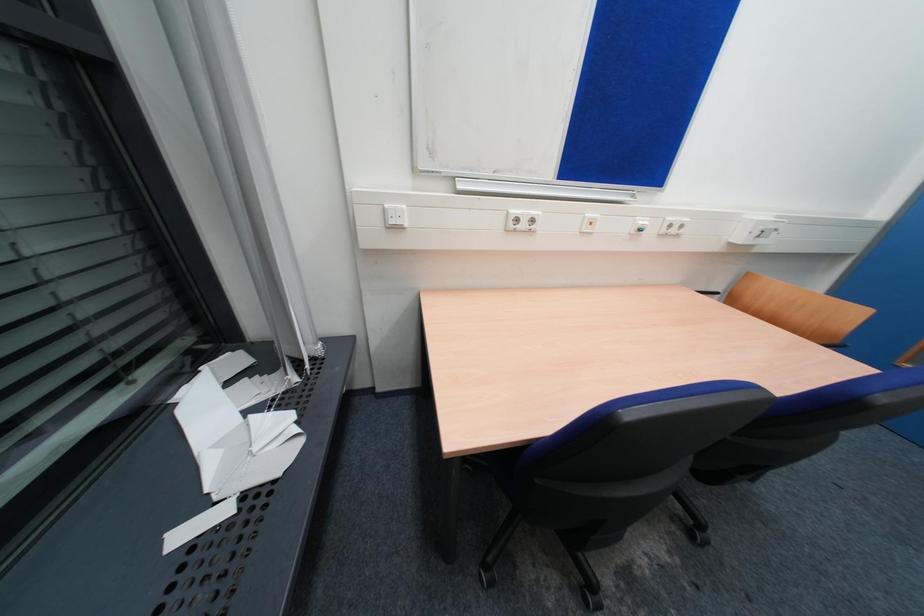
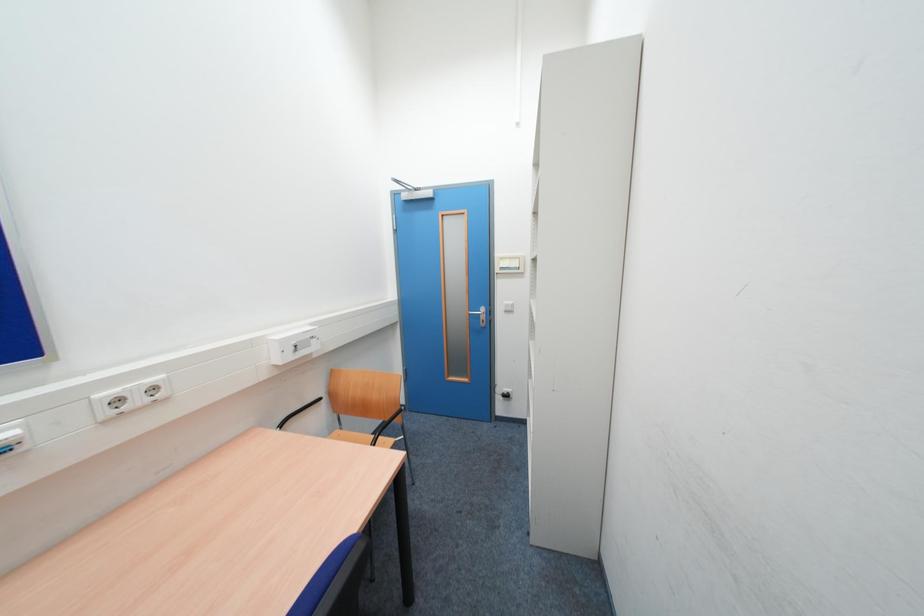
Question: The camera is either moving clockwise (left) or counter-clockwise (right) around the object. The first image is from the beginning of the video and the second image is from the end. Is the camera moving left or right when shooting the video?

Choices:
 (A) Left
 (B) Right

Answer: (A)